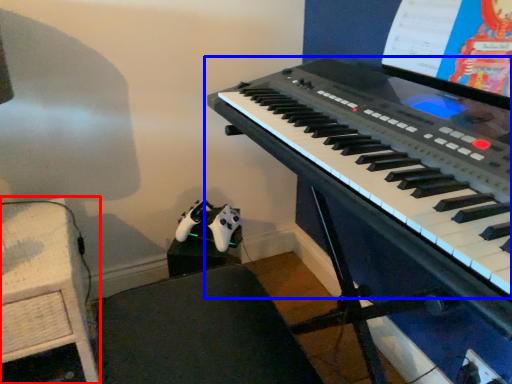
Question: Which point is further to the camera, table (highlighted by a red box) or musical keyboard (highlighted by a blue box)?

Choices:
 (A) table
 (B) musical keyboard

Answer: (A)